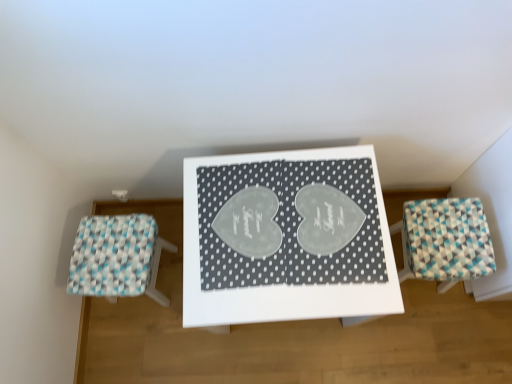
Locate an element on the screen. free point above white woven stool at left, the 2th furniture positioned from the right (from a real-world perspective) is located at coordinates (112, 252).